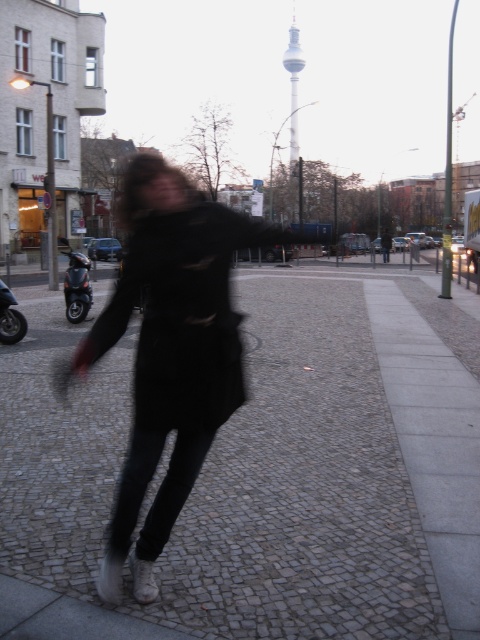
You are a delivery person who needs to reach the television tower in Berlin. You have a scooter that can travel 10 feet per second. The brushed metal scooter at left is 37.62 feet away from you. How many seconds will it take to reach the television tower?

The distance between you and the brushed metal scooter at left is 37.62 feet. Since the scooter can travel at 10 feet per second, it will take 3.762 seconds to reach the television tower.

You are a delivery person trying to reach the television tower in the background. You see a ripped black coat at center and a brushed metal scooter at left. Which object is closer to the path leading to the television tower?

The ripped black coat at center is positioned on the right side of the brushed metal scooter at left, so the scooter is closer to the path leading to the television tower since it is positioned to the left of the coat.